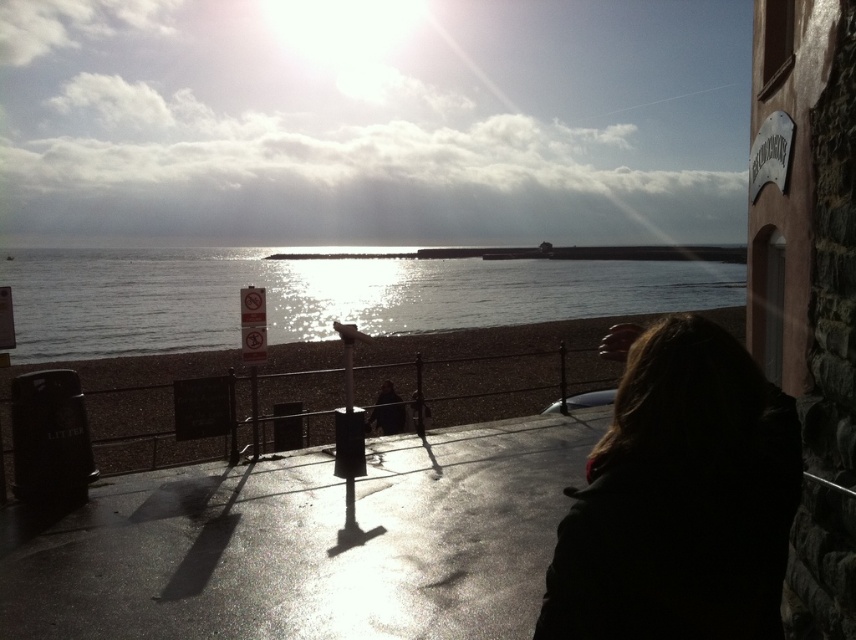
Who is positioned more to the left, glistening water at center or smooth sand at lower center?

Positioned to the left is glistening water at center.

Who is higher up, glistening water at center or smooth sand at lower center?

glistening water at center

Measure the distance between glistening water at center and camera.

glistening water at center is 6.32 meters away from camera.

Identify the location of glistening water at center. (319, 296).

Can you confirm if dark brown hair at lower right is bigger than smooth sand at lower center?

Actually, dark brown hair at lower right might be smaller than smooth sand at lower center.

Does point (651, 372) lie behind point (504, 392)?

That is False.

Describe the element at coordinates (681, 499) in the screenshot. I see `dark brown hair at lower right` at that location.

Locate an element on the screen. dark brown hair at lower right is located at coordinates (681, 499).

Does dark brown hair at lower right have a lesser height compared to glistening water at center?

Indeed, dark brown hair at lower right has a lesser height compared to glistening water at center.

Who is more distant from viewer, (682, 474) or (135, 339)?

The point (135, 339) is more distant.

Between point (752, 557) and point (125, 339), which one is positioned behind?

Positioned behind is point (125, 339).

You are a GUI agent. You are given a task and a screenshot of the screen. Output one action in this format:
    pyautogui.click(x=<x>, y=<y>)
    Task: Click on the dark brown hair at lower right
    The width and height of the screenshot is (856, 640).
    Given the screenshot: What is the action you would take?
    [x=681, y=499]